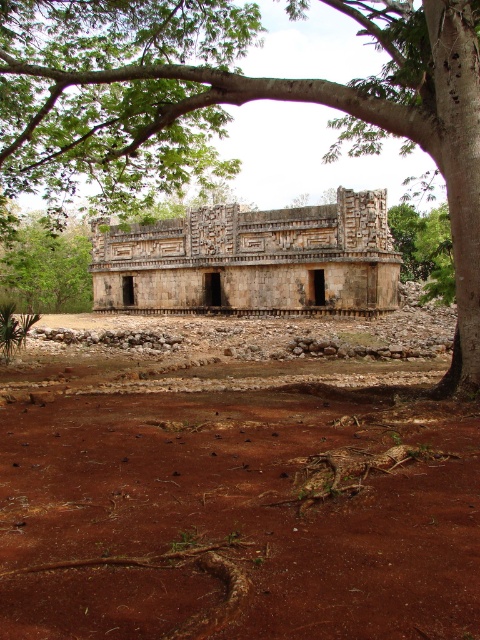
Question: Which of these objects is positioned farthest from the green leafy tree at upper left?

Choices:
 (A) stone textured temple at center
 (B) brown soil at center
 (C) green leafy tree at upper center

Answer: (B)

Question: Estimate the real-world distances between objects in this image. Which object is closer to the brown soil at center?

Choices:
 (A) stone textured temple at center
 (B) green leafy tree at upper left
 (C) green leafy tree at upper center

Answer: (C)

Question: Does brown soil at center have a smaller size compared to green leafy tree at upper left?

Choices:
 (A) yes
 (B) no

Answer: (B)

Question: Is green leafy tree at upper center to the right of green leafy tree at upper left from the viewer's perspective?

Choices:
 (A) yes
 (B) no

Answer: (A)

Question: Is brown soil at center thinner than green leafy tree at upper center?

Choices:
 (A) yes
 (B) no

Answer: (A)

Question: Which of these objects is positioned closest to the green leafy tree at upper center?

Choices:
 (A) green leafy tree at upper left
 (B) stone textured temple at center

Answer: (B)